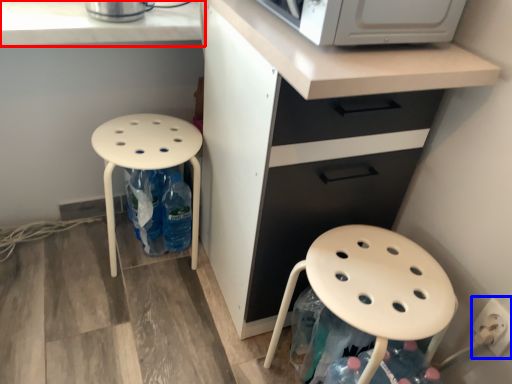
Question: Which object appears farthest to the camera in this image, countertop (highlighted by a red box) or electric outlet (highlighted by a blue box)?

Choices:
 (A) countertop
 (B) electric outlet

Answer: (A)